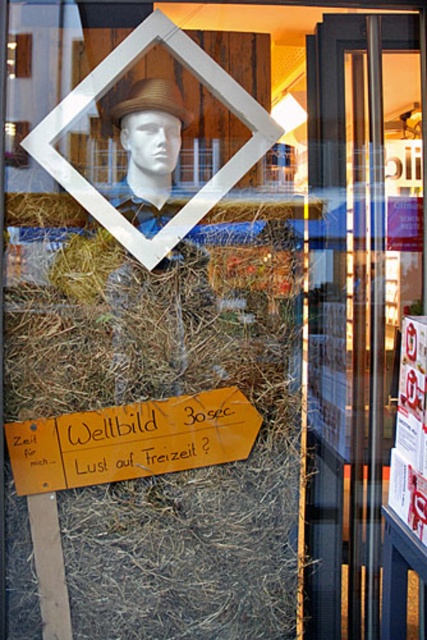
Question: Does orange paper sign at lower center have a lesser width compared to matte brown hat at upper center?

Choices:
 (A) no
 (B) yes

Answer: (A)

Question: Does wooden signboard at center appear on the left side of matte brown hat at upper center?

Choices:
 (A) yes
 (B) no

Answer: (B)

Question: Which point is farther to the camera?

Choices:
 (A) (342, 385)
 (B) (134, 116)
 (C) (169, 90)
 (D) (231, 428)

Answer: (A)

Question: Which of the following is the closest to the observer?

Choices:
 (A) wooden signboard at center
 (B) matte brown hat at upper center

Answer: (B)

Question: Which point is closer to the camera taking this photo?

Choices:
 (A) (249, 426)
 (B) (125, 444)
 (C) (363, 26)
 (D) (114, 189)

Answer: (B)

Question: Can you confirm if wooden signboard at center is positioned to the left of matte brown hat at upper center?

Choices:
 (A) no
 (B) yes

Answer: (A)